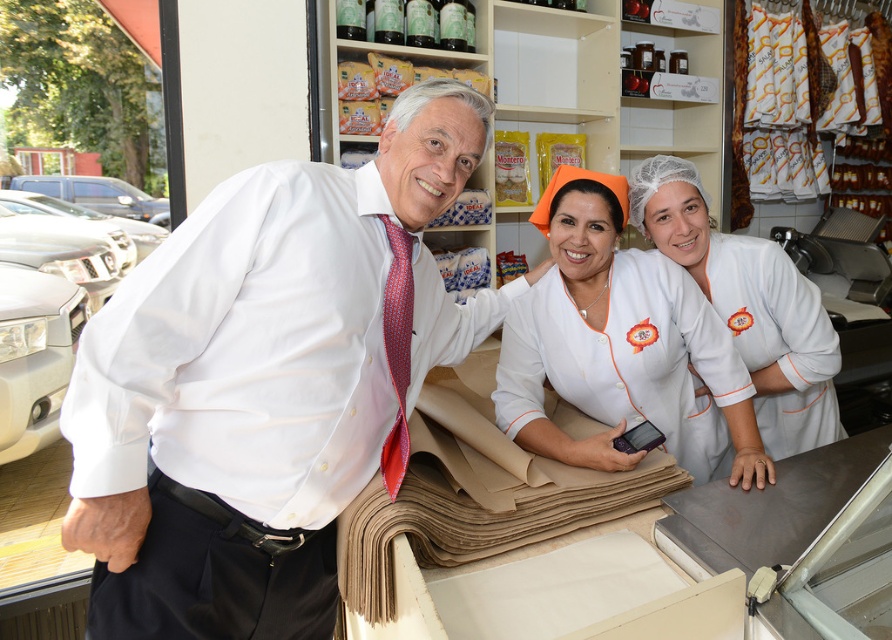
You are a customer trying to place an order at the bakery. You see the brown paper at center and the white fabric uniform at center. Which item is wider from your perspective?

The brown paper at center might be wider than the white fabric uniform at center, so it appears wider from your perspective.

You are a customer in the bakery and want to place an order. You see the white smooth shirt at center and the brown paper at center. Which item is taller when viewed from the front?

The white smooth shirt at center is taller than the brown paper at center.

You are a customer in the bakery and want to identify the staff members. Which object is located below the other between the white smooth shirt at center and the white fabric uniform at center?

The white smooth shirt at center is positioned under the white fabric uniform at center, so the white smooth shirt at center is below the white fabric uniform at center.